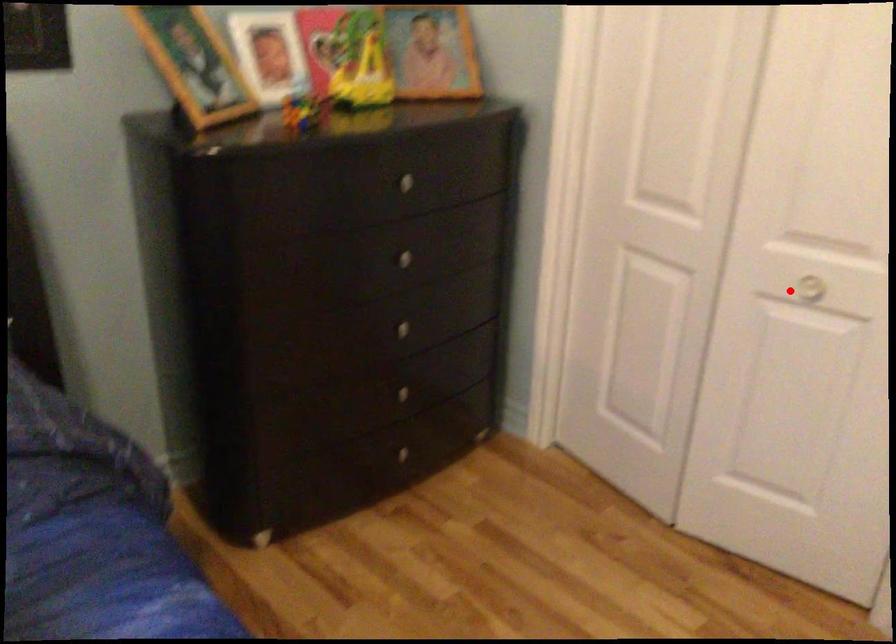
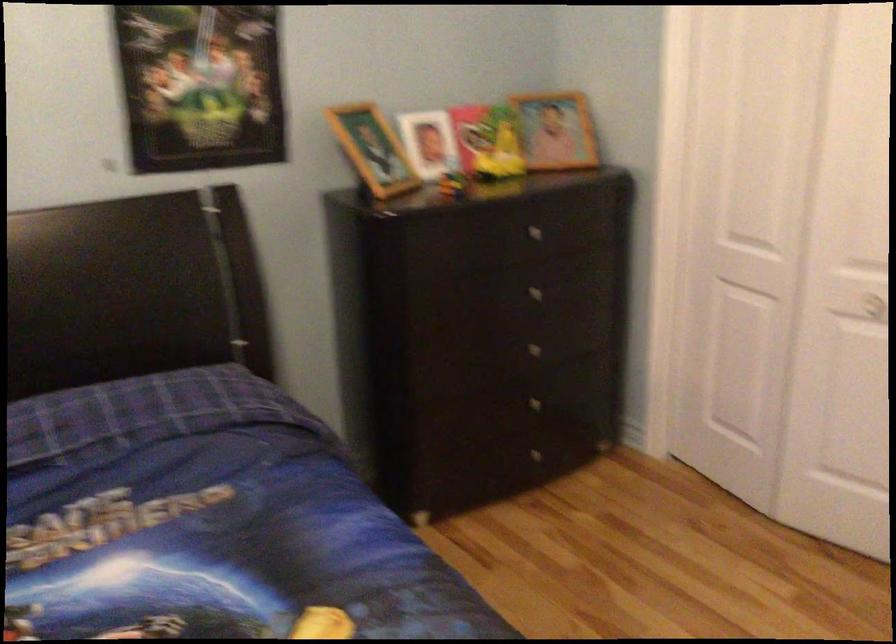
Question: I am providing you with two images of the same scene from different viewpoints. A red point is shown in image1. For the corresponding object point in image2, is it positioned nearer or farther from the camera?

Choices:
 (A) Nearer
 (B) Farther

Answer: (B)